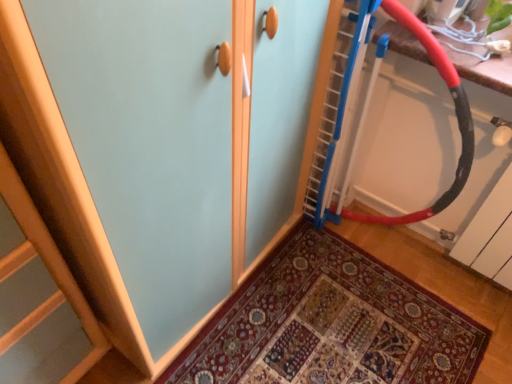
I want to click on vacant space underneath red rubber battle rope at upper right (from a real-world perspective), so click(365, 245).